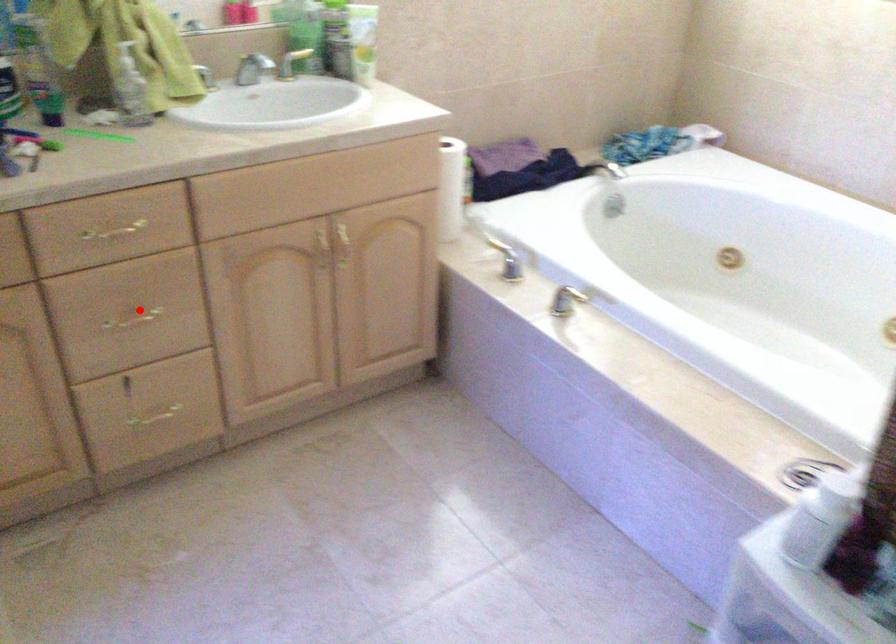
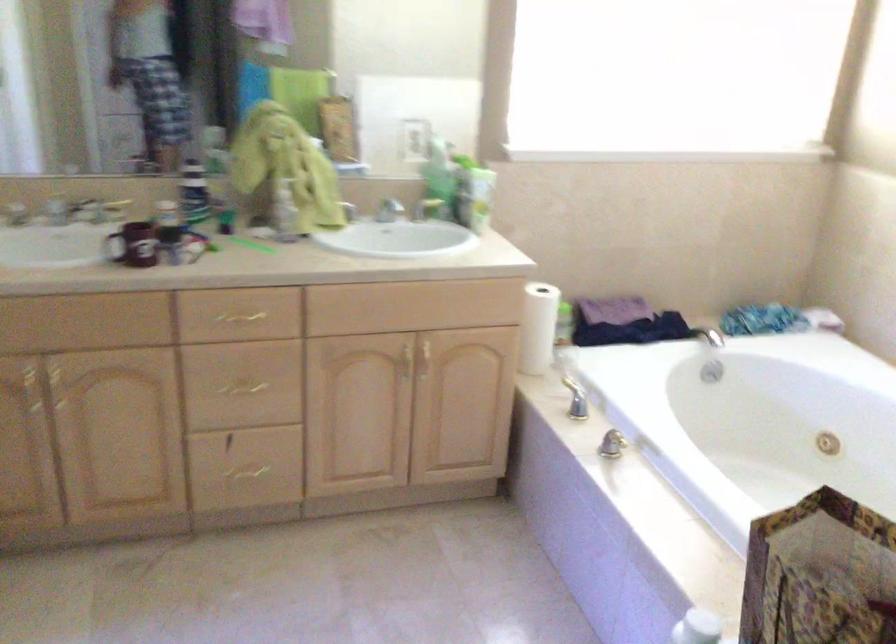
Locate, in the second image, the point that corresponds to the highlighted location in the first image.

(247, 382)